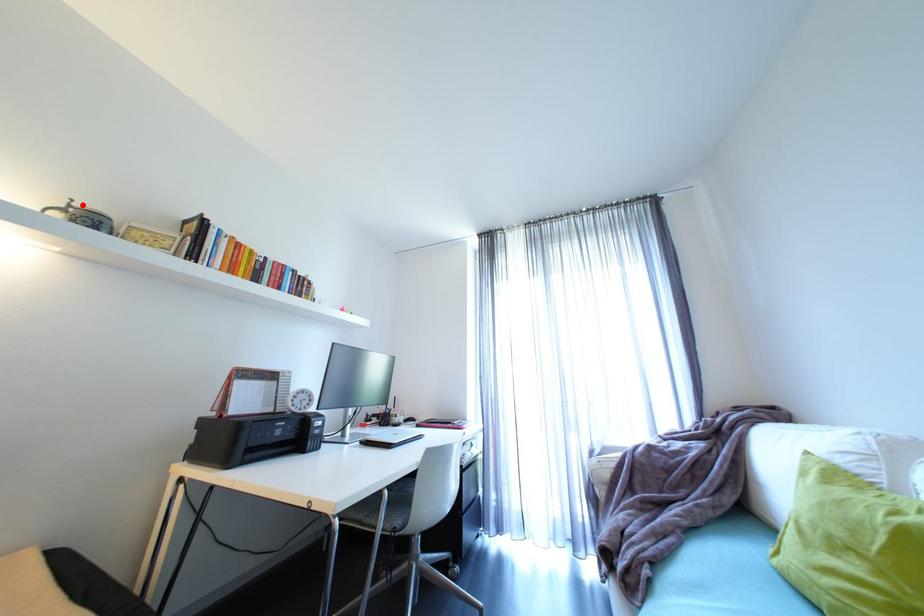
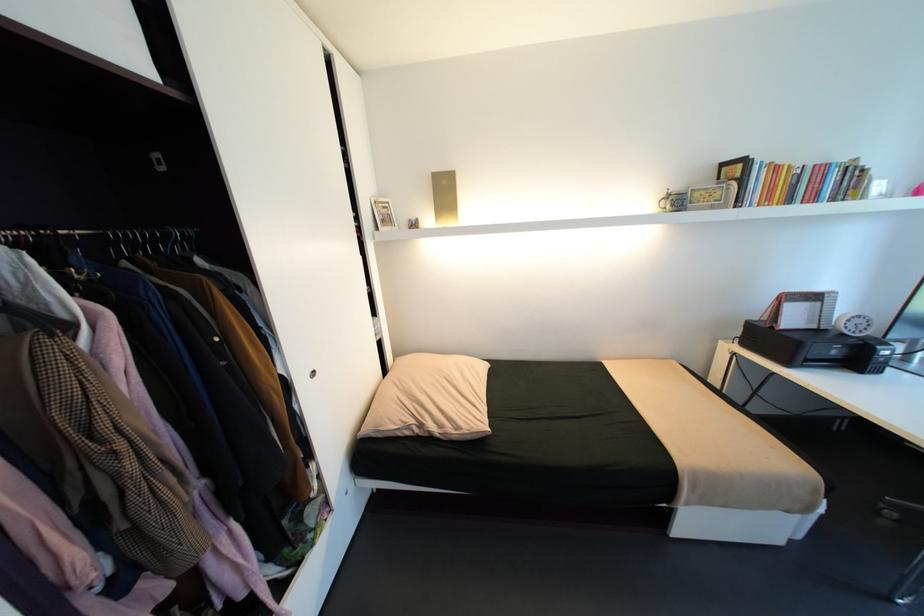
Locate, in the second image, the point that corresponds to the highlighted location in the first image.

(676, 192)